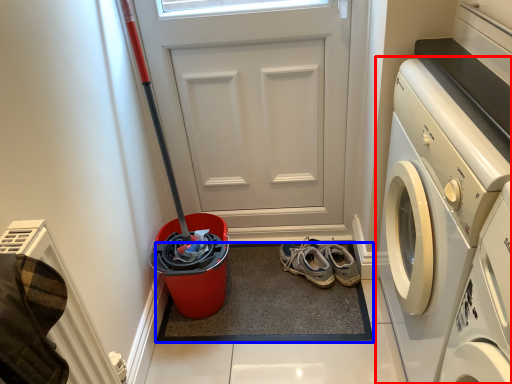
Question: Among these objects, which one is farthest to the camera, washing machine (highlighted by a red box) or doormat (highlighted by a blue box)?

Choices:
 (A) washing machine
 (B) doormat

Answer: (B)